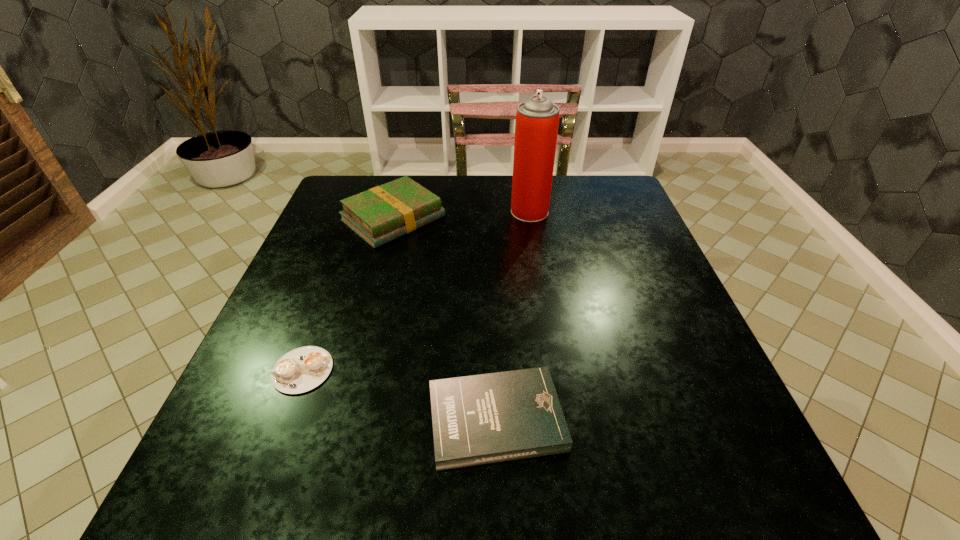
Find the location of `the tallest object`. the tallest object is located at coordinates (537, 119).

The height and width of the screenshot is (540, 960). I want to click on the left book, so click(x=379, y=215).

Find the location of `the farther book`. the farther book is located at coordinates (379, 215).

In order to click on the right book in this screenshot , I will do `click(480, 419)`.

Find the location of a particular element. This screenshot has height=540, width=960. the shorter book is located at coordinates (480, 419).

Image resolution: width=960 pixels, height=540 pixels. I want to click on cappuccino, so click(x=302, y=369).

Image resolution: width=960 pixels, height=540 pixels. In order to click on vacant space situated 0.160m on the left of the tallest object in this screenshot , I will do `click(452, 212)`.

Find the location of a particular element. vacant space located 0.290m on the right of the second tallest object is located at coordinates (555, 219).

The height and width of the screenshot is (540, 960). Identify the location of vacant region located 0.100m on the back of the nearer book. (493, 334).

Identify the location of free region located on the front of the shortest object. The width and height of the screenshot is (960, 540). (273, 450).